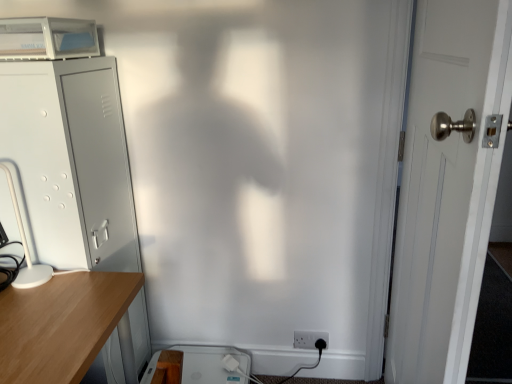
Measure the distance between point (25,271) and camera.

A distance of 4.34 feet exists between point (25,271) and camera.

Identify the location of white plastic desktop at lower center. The width and height of the screenshot is (512, 384). (211, 364).

This screenshot has width=512, height=384. I want to click on white wooden door at right, so click(447, 188).

Based on their positions, is white plastic electric outlet at lower right located to the left or right of white wooden door at right?

Clearly, white plastic electric outlet at lower right is on the left of white wooden door at right in the image.

Based on the photo, from the image's perspective, is white plastic electric outlet at lower right beneath white wooden door at right?

Correct, white plastic electric outlet at lower right appears lower than white wooden door at right in the image.

Is white plastic electric outlet at lower right oriented away from white wooden door at right?

No.

Is white plastic electric outlet at lower right not near white wooden door at right?

white plastic electric outlet at lower right is near white wooden door at right, not far away.

Which of these two, white plastic desktop at lower center or white plastic table lamp at left, stands shorter?

white plastic desktop at lower center.

From a real-world perspective, between white plastic desktop at lower center and white plastic table lamp at left, who is vertically lower?

white plastic desktop at lower center, from a real-world perspective.

Where is `desktop on the right of white plastic table lamp at left`? Image resolution: width=512 pixels, height=384 pixels. desktop on the right of white plastic table lamp at left is located at coordinates [x=211, y=364].

Does point (238, 361) come behind point (33, 266)?

That is True.

From the image's perspective, which one is positioned higher, white wooden door at right or white plastic electric outlet at lower right?

white wooden door at right appears higher in the image.

Considering their positions, is white wooden door at right located in front of or behind white plastic electric outlet at lower right?

white wooden door at right is in front of white plastic electric outlet at lower right.

From the image's perspective, is gray metallic file cabinet at left located above or below white plastic desktop at lower center?

From the image's perspective, gray metallic file cabinet at left appears above white plastic desktop at lower center.

Can you confirm if gray metallic file cabinet at left is taller than white plastic desktop at lower center?

Yes.

Would you say gray metallic file cabinet at left is inside or outside white plastic desktop at lower center?

gray metallic file cabinet at left is not inside white plastic desktop at lower center, it's outside.

Identify the location of file cabinet above the white plastic electric outlet at lower right (from the image's perspective). This screenshot has height=384, width=512. (70, 162).

Which of these two, white plastic electric outlet at lower right or gray metallic file cabinet at left, stands shorter?

white plastic electric outlet at lower right.

Based on the photo, between white plastic electric outlet at lower right and gray metallic file cabinet at left, which one has smaller size?

white plastic electric outlet at lower right.

Could you tell me if white plastic table lamp at left is facing white plastic desktop at lower center?

No.

In the image, is white plastic table lamp at left positioned in front of or behind white plastic desktop at lower center?

white plastic table lamp at left is in front of white plastic desktop at lower center.

From a real-world perspective, is white plastic table lamp at left physically above white plastic desktop at lower center?

Yes, from a real-world perspective, white plastic table lamp at left is above white plastic desktop at lower center.

Is white plastic desktop at lower center located within white plastic table lamp at left?

No, white plastic table lamp at left does not contain white plastic desktop at lower center.

Looking at the image, does white wooden door at right seem bigger or smaller compared to white plastic table lamp at left?

In the image, white wooden door at right appears to be larger than white plastic table lamp at left.

Consider the image. From a real-world perspective, which is physically above, white wooden door at right or white plastic table lamp at left?

white plastic table lamp at left, from a real-world perspective.

Can you confirm if white wooden door at right is shorter than white plastic table lamp at left?

In fact, white wooden door at right may be taller than white plastic table lamp at left.

From the image's perspective, is white wooden door at right above white plastic table lamp at left?

No.

This screenshot has width=512, height=384. Identify the location of electric outlet below the white wooden door at right (from a real-world perspective). (309, 339).

You are a GUI agent. You are given a task and a screenshot of the screen. Output one action in this format:
    pyautogui.click(x=<x>, y=<y>)
    Task: Click on the desktop that is below the white plastic table lamp at left (from the image's perspective)
    The width and height of the screenshot is (512, 384).
    Given the screenshot: What is the action you would take?
    pyautogui.click(x=211, y=364)

When comparing their distances from white plastic desktop at lower center, does white plastic electric outlet at lower right or white plastic table lamp at left seem further?

The object further to white plastic desktop at lower center is white plastic table lamp at left.

In the scene shown: Which object lies nearer to the anchor point white plastic electric outlet at lower right, white plastic table lamp at left or white plastic desktop at lower center?

Among the two, white plastic desktop at lower center is located nearer to white plastic electric outlet at lower right.

Based on their spatial positions, is white wooden door at right or white plastic desktop at lower center closer to white plastic table lamp at left?

white plastic desktop at lower center is positioned closer to the anchor white plastic table lamp at left.

Looking at the image, which one is located further to white plastic table lamp at left, white plastic desktop at lower center or white wooden door at right?

white wooden door at right is further to white plastic table lamp at left.

Considering their positions, is gray metallic file cabinet at left positioned further to white wooden door at right than white plastic table lamp at left?

The object further to white wooden door at right is white plastic table lamp at left.

When comparing their distances from white wooden door at right, does gray metallic file cabinet at left or white plastic electric outlet at lower right seem closer?

white plastic electric outlet at lower right is positioned closer to the anchor white wooden door at right.

From the image, which object appears to be farther from white plastic electric outlet at lower right, white plastic table lamp at left or gray metallic file cabinet at left?

white plastic table lamp at left lies further to white plastic electric outlet at lower right than the other object.

Based on their spatial positions, is gray metallic file cabinet at left or white wooden door at right closer to white plastic electric outlet at lower right?

white wooden door at right is closer to white plastic electric outlet at lower right.

This screenshot has width=512, height=384. Find the location of `electric outlet located between gray metallic file cabinet at left and white wooden door at right in the left-right direction`. electric outlet located between gray metallic file cabinet at left and white wooden door at right in the left-right direction is located at coordinates pos(309,339).

Find the location of a particular element. file cabinet between white plastic table lamp at left and white plastic desktop at lower center vertically is located at coordinates [70, 162].

At what (x,y) coordinates should I click in order to perform the action: click on desktop between gray metallic file cabinet at left and white plastic electric outlet at lower right in the horizontal direction. Please return your answer as a coordinate pair (x, y). Looking at the image, I should click on (211, 364).

Locate an element on the screen. The image size is (512, 384). desktop between gray metallic file cabinet at left and white wooden door at right in the horizontal direction is located at coordinates pos(211,364).